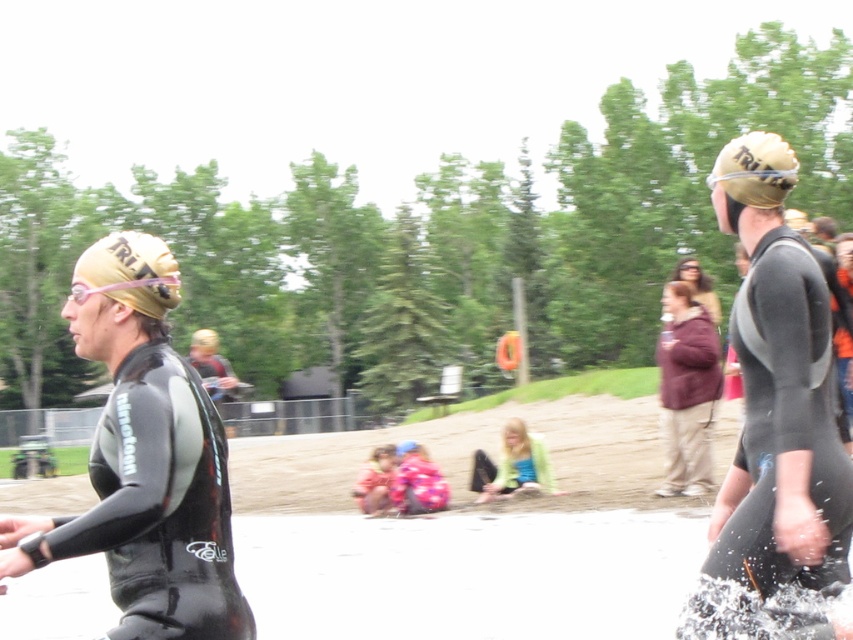
In the triathlon scene, you see a matte black wetsuit at right and a maroon fleece jacket at center. Which object is positioned to the left of the other?

The matte black wetsuit at right is to the left of the maroon fleece jacket at center.

You are a photographer positioned at the center of the scene. You need to capture a photo that includes both the black matte wetsuit at left and the matte gold helmet at upper center. Based on their positions, which direction should you move to ensure both are in frame?

The black matte wetsuit at left is to the left of the matte gold helmet at upper center. To include both in the frame, you should move to the right so that the black matte wetsuit at left remains visible on the left side and the matte gold helmet at upper center stays centered.